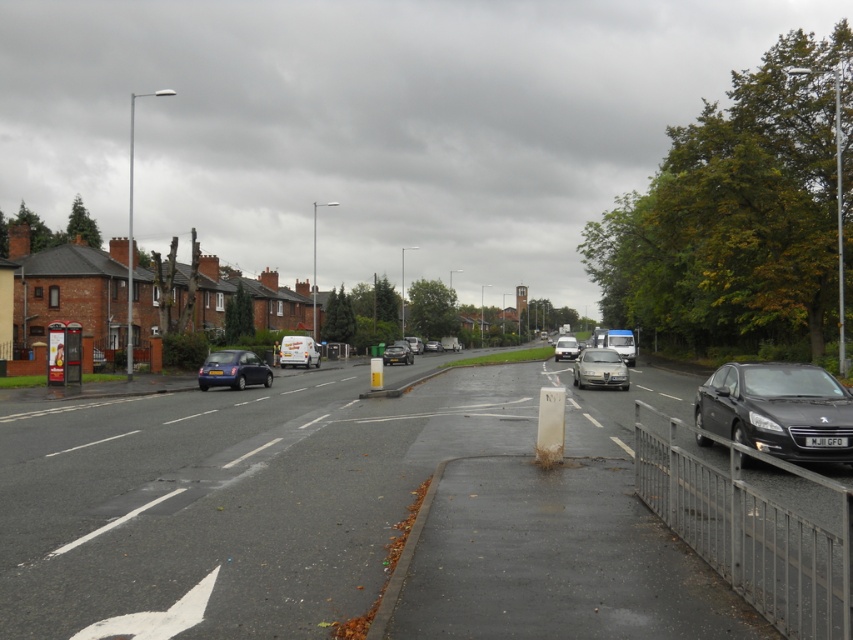
Question: Which point is closer to the camera taking this photo?

Choices:
 (A) (401, 344)
 (B) (766, 403)
 (C) (212, 372)

Answer: (B)

Question: Which point is closer to the camera?

Choices:
 (A) pyautogui.click(x=621, y=349)
 (B) pyautogui.click(x=595, y=364)
 (C) pyautogui.click(x=564, y=342)

Answer: (B)

Question: Can you confirm if metallic gray sedan at center is bigger than metallic silver van at center?

Choices:
 (A) yes
 (B) no

Answer: (B)

Question: Is metallic blue hatchback at center-left to the right of metallic gray sedan at center from the viewer's perspective?

Choices:
 (A) no
 (B) yes

Answer: (A)

Question: Is metallic silver van at center bigger than shiny black sedan at center?

Choices:
 (A) yes
 (B) no

Answer: (A)

Question: Which of these objects is positioned closest to the matte black car at right?

Choices:
 (A) metallic blue hatchback at center-left
 (B) white matte van at center
 (C) metallic silver van at center
 (D) silver metallic van at center

Answer: (A)